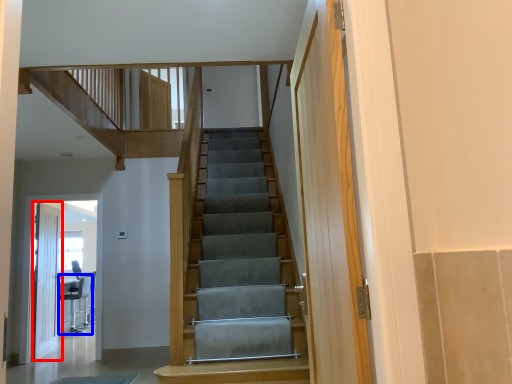
Question: Which of the following is the farthest to the observer, door (highlighted by a red box) or chair (highlighted by a blue box)?

Choices:
 (A) door
 (B) chair

Answer: (B)